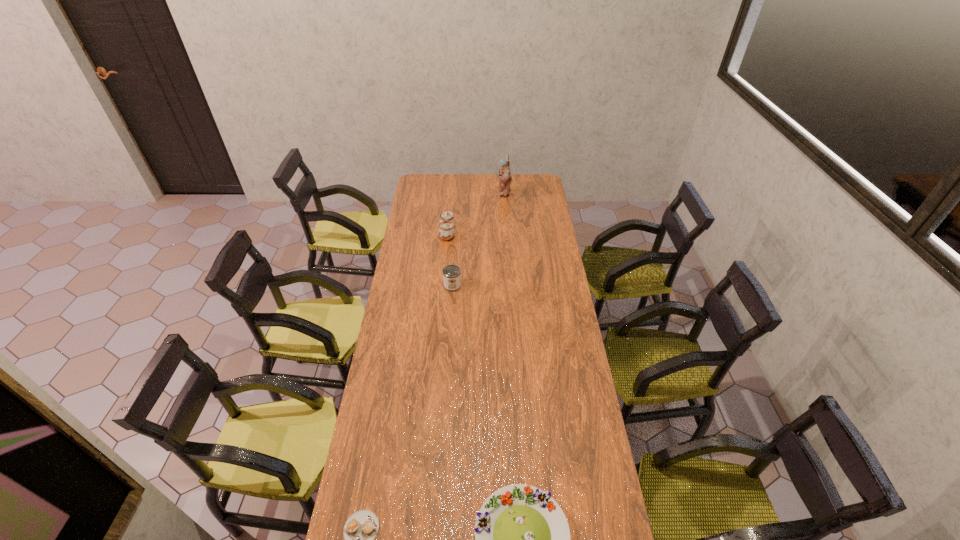
This screenshot has height=540, width=960. I want to click on free space located 0.350m on the front of the can, so click(x=448, y=348).

I want to click on object that is at the far edge, so click(x=505, y=177).

Identify the location of free spot at the far edge of the desktop. (446, 191).

Locate an element on the screen. free region at the left edge is located at coordinates (419, 260).

What are the coordinates of `vacant area at the right edge of the desktop` in the screenshot? It's located at (596, 485).

Where is `free spot at the far right corner of the desktop`? Image resolution: width=960 pixels, height=540 pixels. free spot at the far right corner of the desktop is located at coordinates (531, 193).

Where is `vacant region between the figurine and the fourth shortest object`? vacant region between the figurine and the fourth shortest object is located at coordinates (476, 213).

Locate an element on the screen. This screenshot has height=540, width=960. empty space between the farthest object and the can is located at coordinates (478, 239).

Identify the location of blank region between the chinaware and the third nearest object. This screenshot has width=960, height=540. (450, 260).

Choose which object is the fourth nearest neighbor to the third shortest object. Please provide its 2D coordinates. Your answer should be formatted as a tuple, i.e. [(x, y)], where the tuple contains the x and y coordinates of a point satisfying the conditions above.

[(361, 528)]